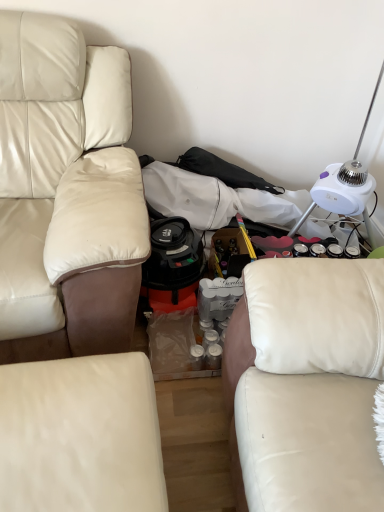
Identify the location of free spot above white leather studio couch at lower center, arranged as the 2th studio couch when viewed from the left (from a real-world perspective). The image size is (384, 512). (71, 416).